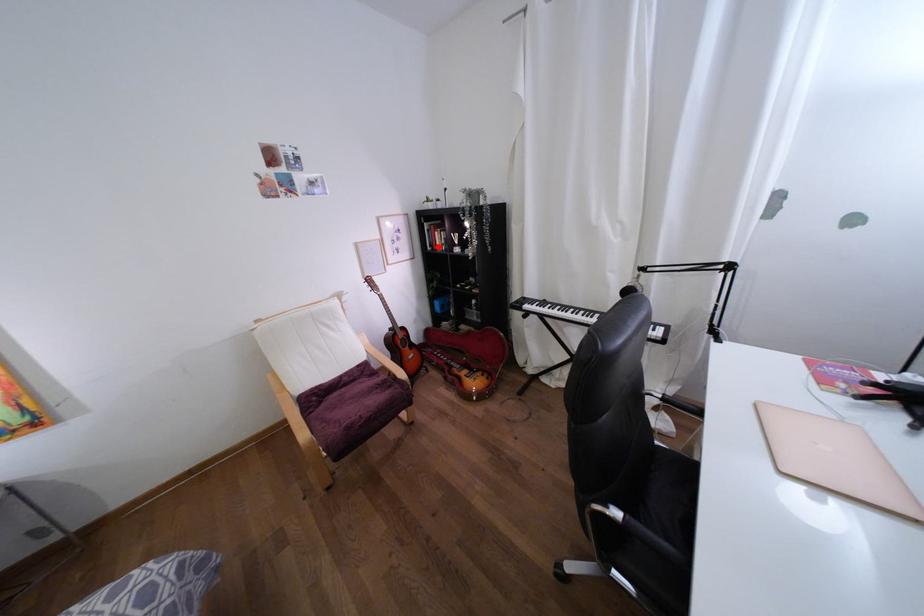
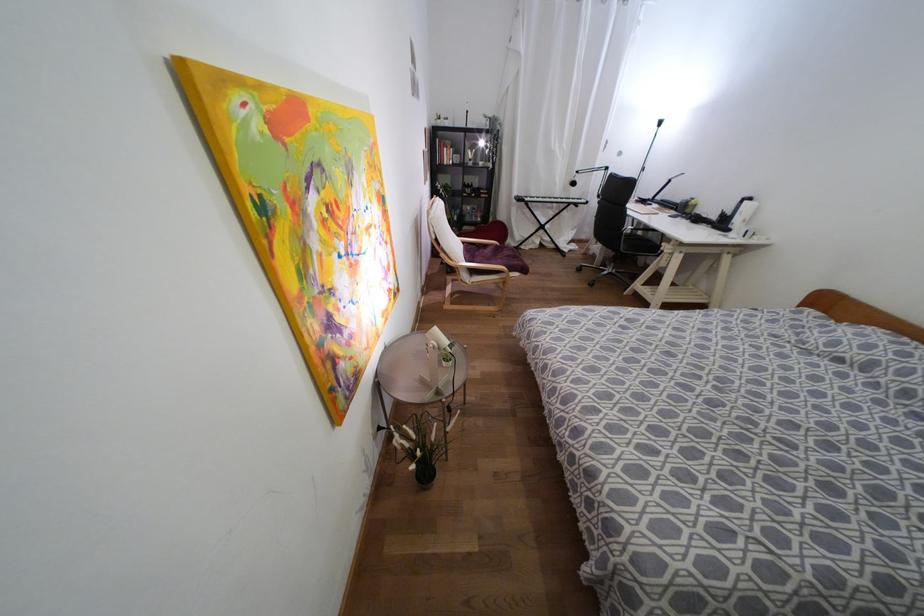
Find the pixel in the second image that matches the highlighted location in the first image.

(444, 161)